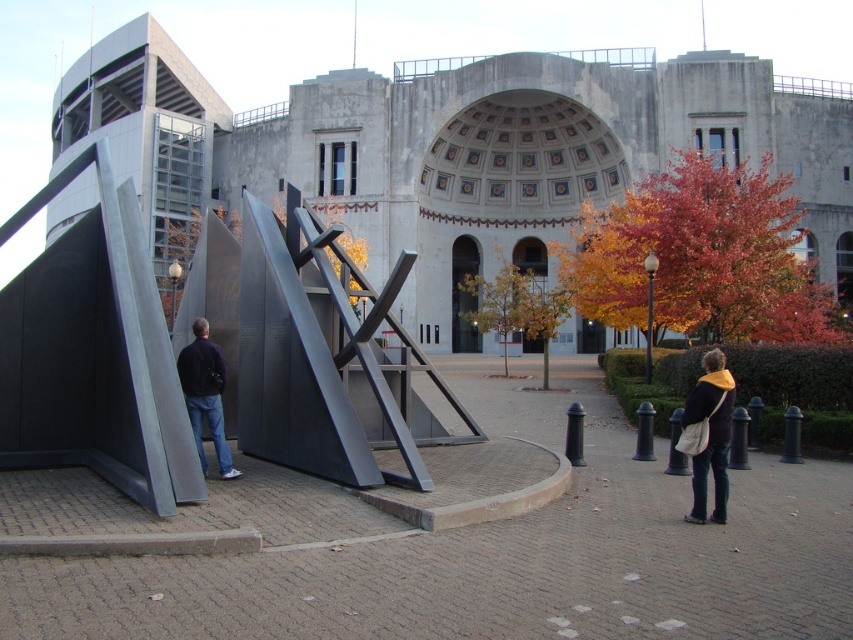
Question: In this image, where is dark blue jeans at lower right located relative to dark blue sweater at left?

Choices:
 (A) below
 (B) above

Answer: (A)

Question: Which point is farther from the camera taking this photo?

Choices:
 (A) (288, 451)
 (B) (177, 362)

Answer: (A)

Question: Among these points, which one is nearest to the camera?

Choices:
 (A) (213, 390)
 (B) (367, 381)
 (C) (722, 518)

Answer: (C)

Question: Does polished steel sculpture at center appear on the left side of dark blue sweater at left?

Choices:
 (A) yes
 (B) no

Answer: (B)

Question: Which point appears farthest from the camera in this image?

Choices:
 (A) (207, 404)
 (B) (387, 449)

Answer: (B)

Question: Can you confirm if dark blue jeans at lower right is bigger than dark blue sweater at left?

Choices:
 (A) no
 (B) yes

Answer: (A)